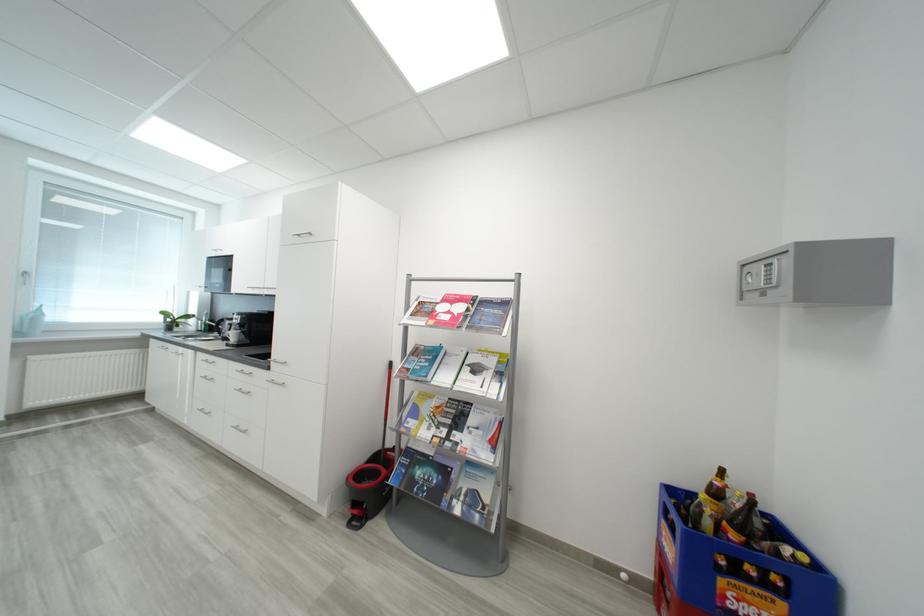
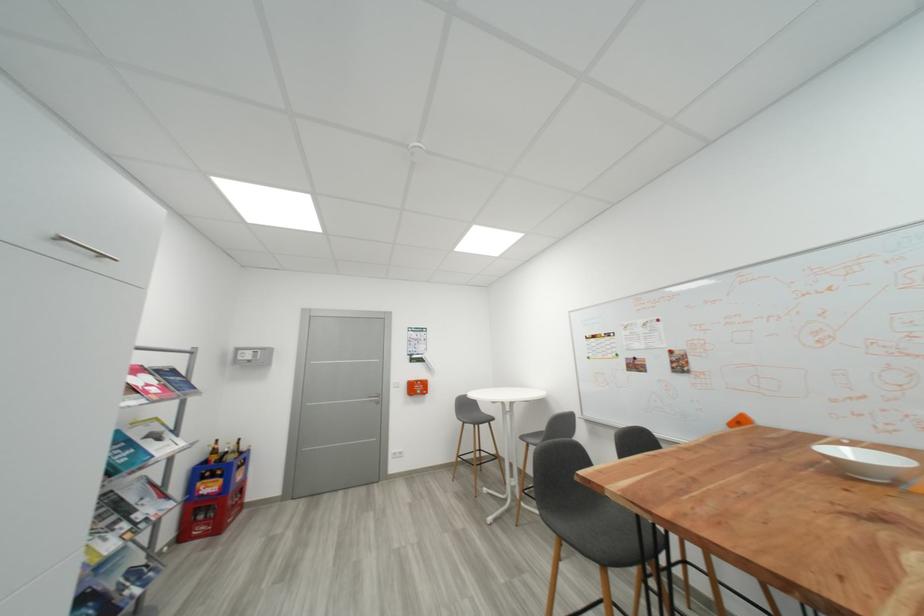
Where in the second image is the point corresponding to [723,493] from the first image?

(223, 454)